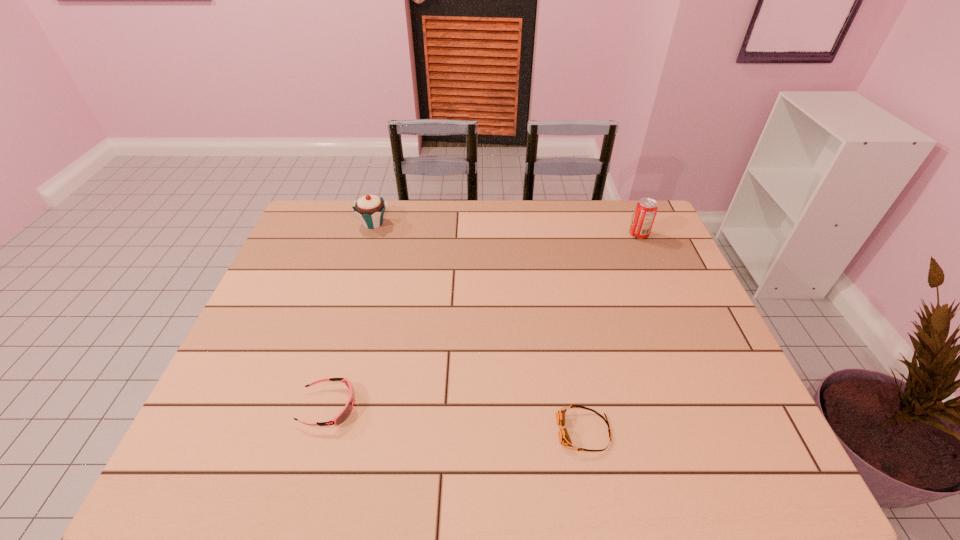
The width and height of the screenshot is (960, 540). I want to click on object that is the second nearest to the left goggles, so click(370, 209).

Where is `object that is the closest one to the shortest object`? Image resolution: width=960 pixels, height=540 pixels. object that is the closest one to the shortest object is located at coordinates (346, 411).

Find the location of a particular element. vacant space that satisfies the following two spatial constraints: 1. on the front side of the rightmost object; 2. on the front-facing side of the left goggles is located at coordinates (712, 406).